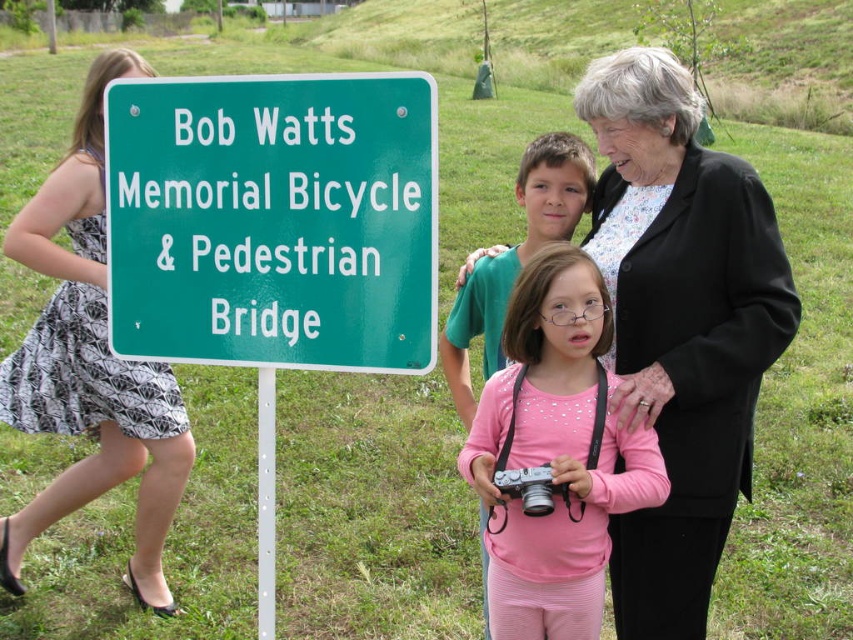
You are a photographer trying to capture the group photo of the people near the Bob Watts Memorial Bridge sign. You notice the silver metallic camera at center and the pink fabric shirt at center. Which object is closer to the camera lens when taking the photo?

The silver metallic camera at center is behind the pink fabric shirt at center, so the pink fabric shirt at center is closer to the camera lens.

You are a photographer trying to capture the green metallic sign at left and the pink fabric shirt at center in a single frame. Based on their sizes in the image, which object should you focus on first to ensure both are in focus?

The green metallic sign at left occupies less space than pink fabric shirt at center, so you should focus on the pink fabric shirt at center first to ensure both are in focus.

You are a photographer trying to capture a photo of the black textured blazer at upper right and the pink fabric shirt at center. Which clothing item will appear larger in the photo?

The black textured blazer at upper right will appear larger in the photo because it is much taller than the pink fabric shirt at center.